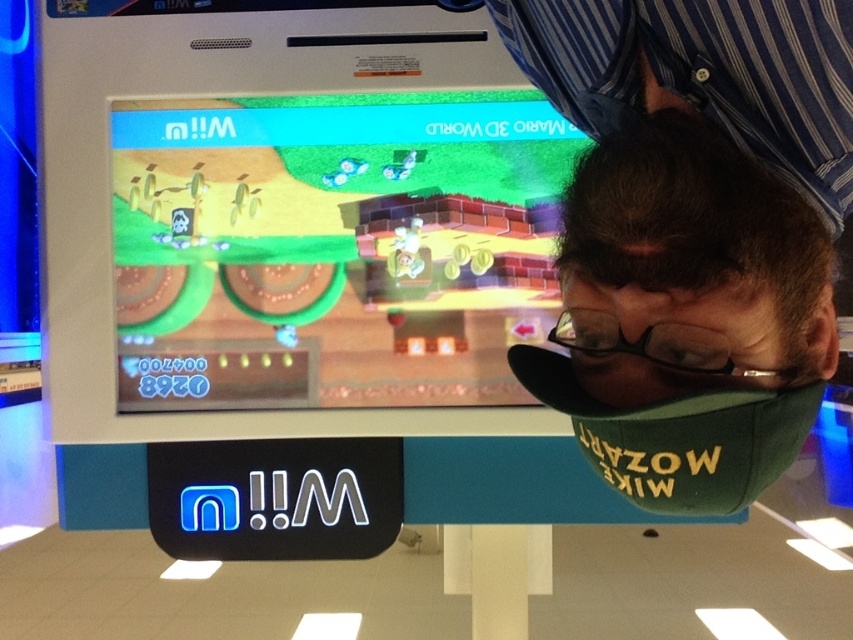
You are sitting at the gaming table and wearing the green fabric cap at center. You need to grab a controller that is on the table. Can you reach it without moving your cap?

The green fabric cap at center and viewer are 22.54 inches apart from each other. Since the cap is part of your headwear, the distance between you and the controller depends on where the controller is placed. However, the cap itself is 22.54 inches away from your eyes, so if the controller is within arm reach on the table, you can likely reach it without moving the cap.

You are a delivery person who needs to place a small package between the green fabric cap at center and the matte green platform at center. The package is 12 inches long. Can you fit it between them without moving either object?

The green fabric cap at center and the matte green platform at center are 29.02 inches apart, so yes, the 12 inch package can fit between them since the distance between the two objects is greater than the package length.